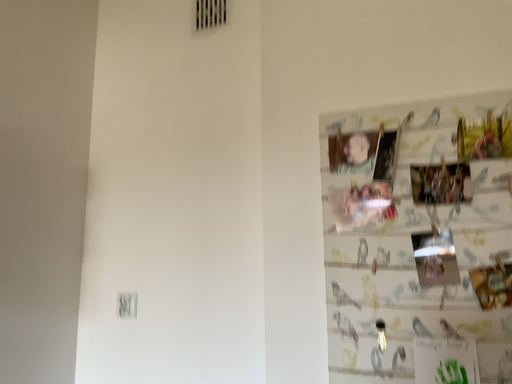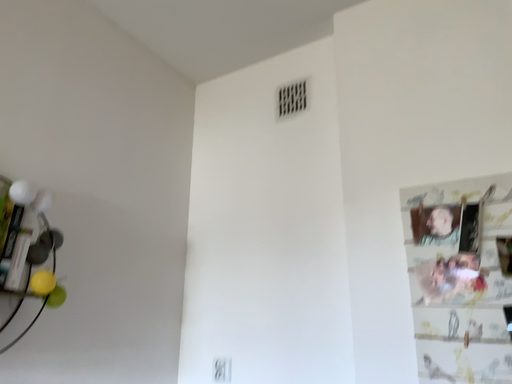
Question: How did the camera likely rotate when shooting the video?

Choices:
 (A) rotated downward
 (B) rotated upward

Answer: (B)